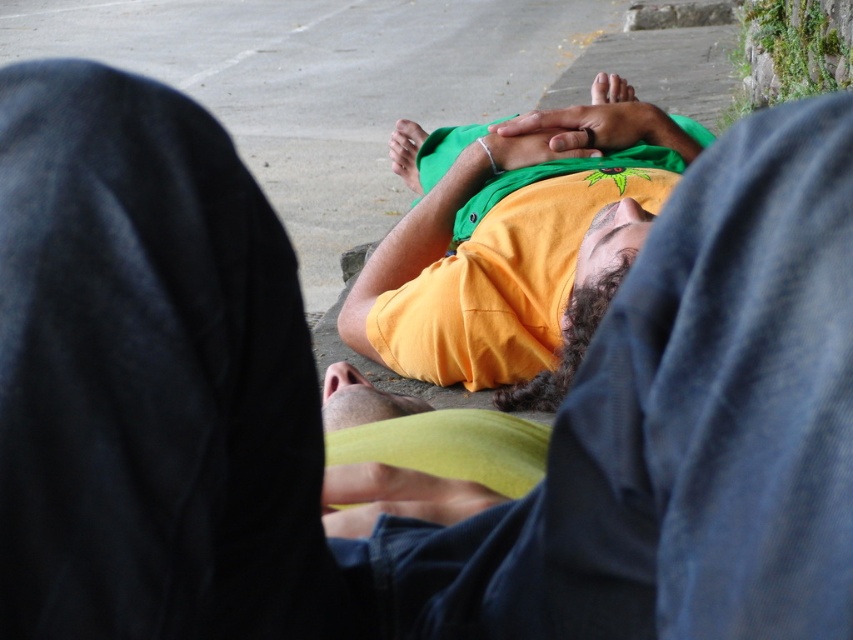
Between matte yellow t-shirt at center and matte yellow head at center, which one has less height?

Standing shorter between the two is matte yellow head at center.

Can you confirm if matte yellow t-shirt at center is positioned above matte yellow head at center?

Indeed, matte yellow t-shirt at center is positioned over matte yellow head at center.

Image resolution: width=853 pixels, height=640 pixels. I want to click on matte yellow t-shirt at center, so click(x=517, y=244).